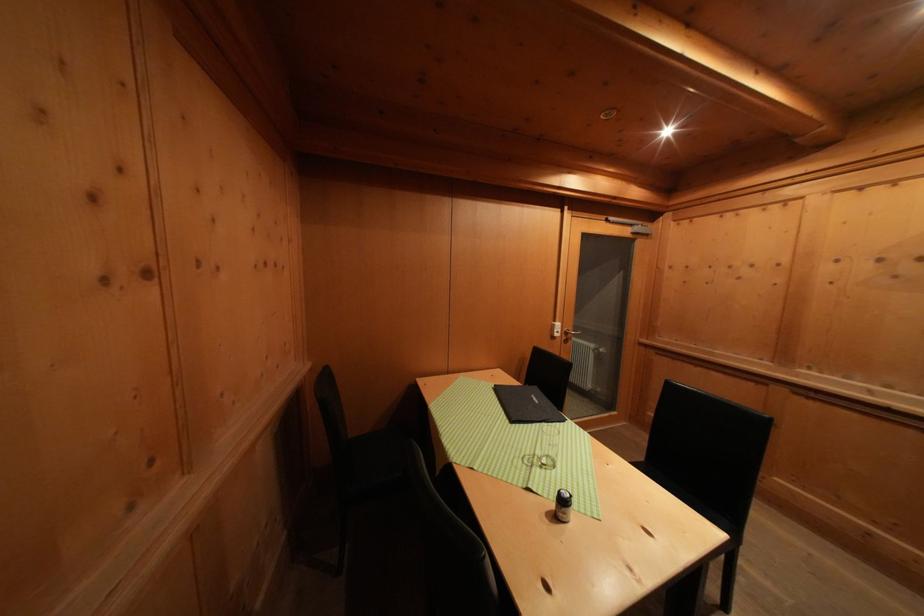
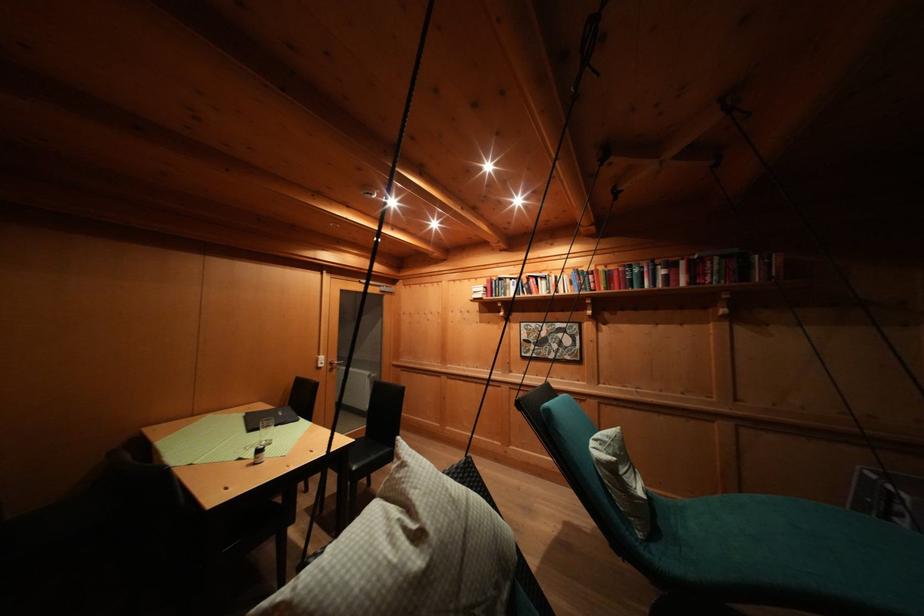
The point at (560, 331) is marked in the first image. Where is the corresponding point in the second image?

(323, 363)